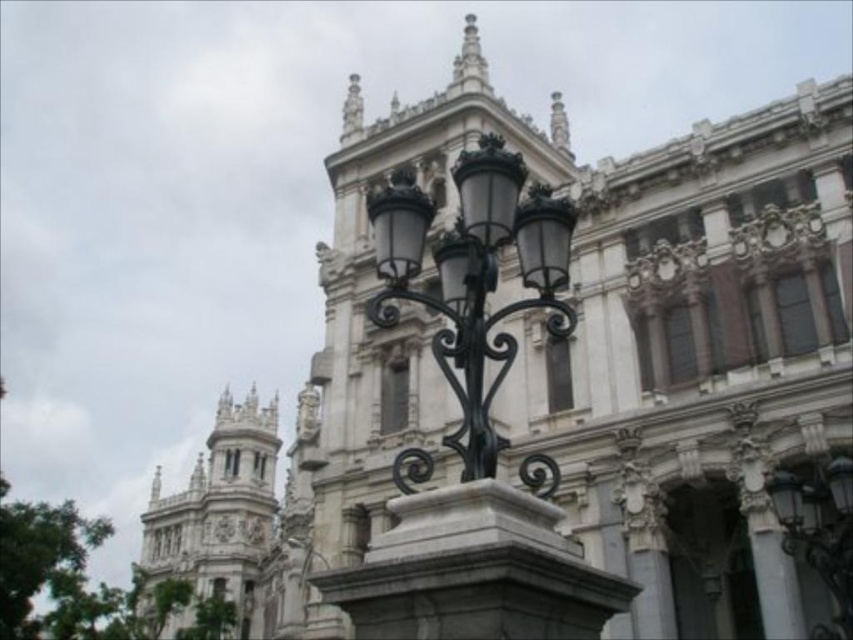
You are an architect analyzing the placement of the polished black metal street light at center in the image. Given its coordinates at point 0.430, 0.556, how does its position align with the building facade?

The polished black metal street light at center is positioned at coordinates (473, 275), which places it centrally aligned with the building facade, enhancing the symmetrical design characteristic of the Baroque or Neoclassical architectural style described in the scene.